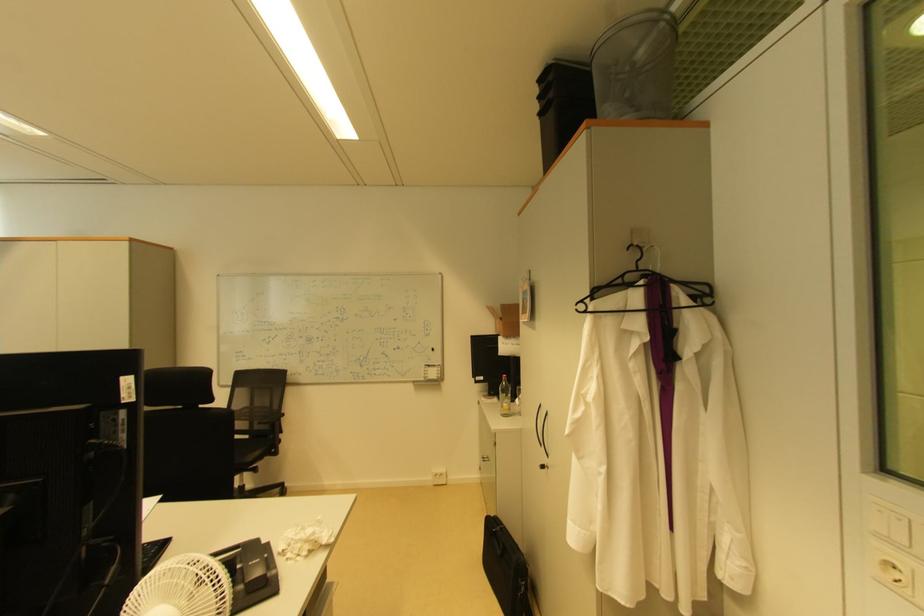
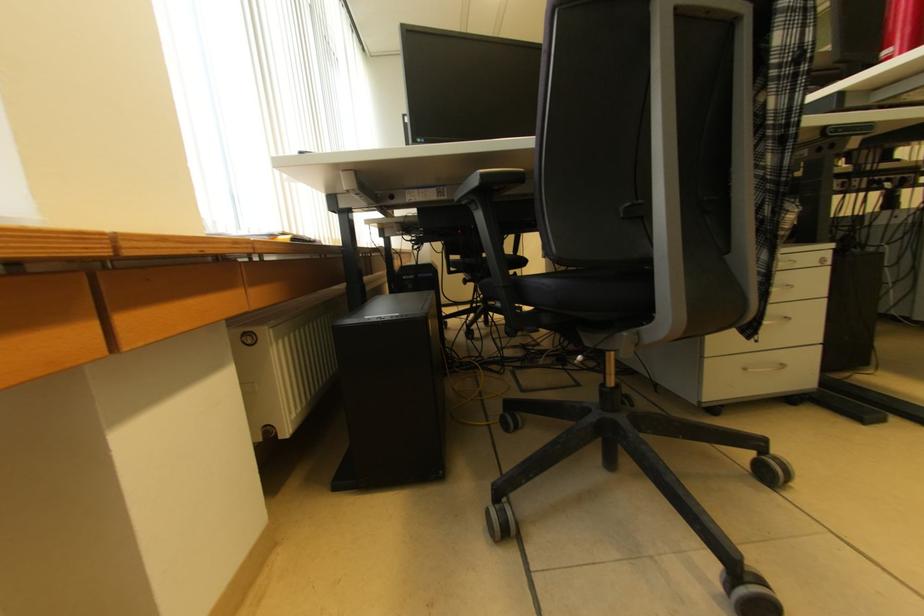
What movement of the cameraman would produce the second image?

The cameraman moved toward left, backward.